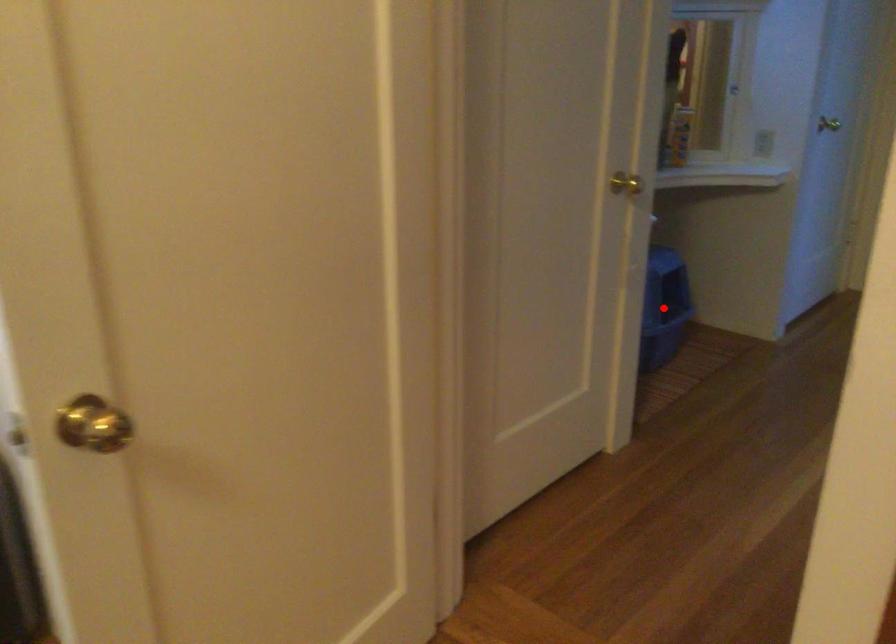
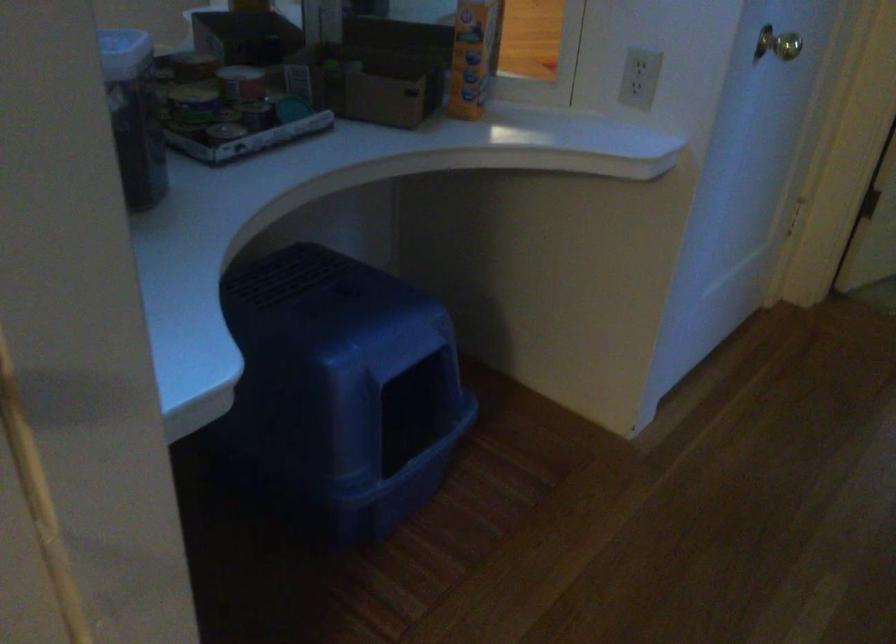
Question: I am providing you with two images of the same scene from different viewpoints. Given a red point in image1, look at the same physical point in image2. Is it:

Choices:
 (A) Closer to the viewpoint
 (B) Farther from the viewpoint

Answer: (A)